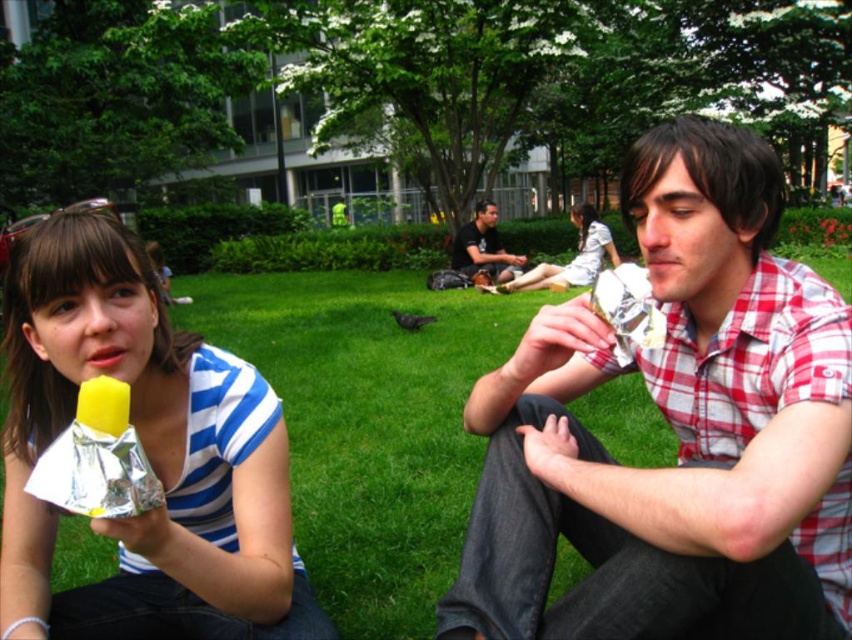
Question: Which is farther from the white cotton dress at center?

Choices:
 (A) matte red plaid shirt at center
 (B) green grass at center
 (C) matte black shirt at center
 (D) white paper wrapped ice cream at center

Answer: (D)

Question: Is matte red plaid shirt at center positioned in front of green grass at center?

Choices:
 (A) yes
 (B) no

Answer: (A)

Question: Can you confirm if matte red plaid shirt at center is positioned to the right of green grass at center?

Choices:
 (A) yes
 (B) no

Answer: (B)

Question: Which of the following is the closest to the observer?

Choices:
 (A) (809, 436)
 (B) (563, 282)
 (C) (499, 248)
 (D) (133, 525)

Answer: (A)

Question: Which point is closer to the camera?

Choices:
 (A) (406, 432)
 (B) (530, 285)
 (C) (488, 250)

Answer: (A)

Question: Can you confirm if white paper wrapped ice cream at center is positioned below matte black shirt at center?

Choices:
 (A) no
 (B) yes

Answer: (B)